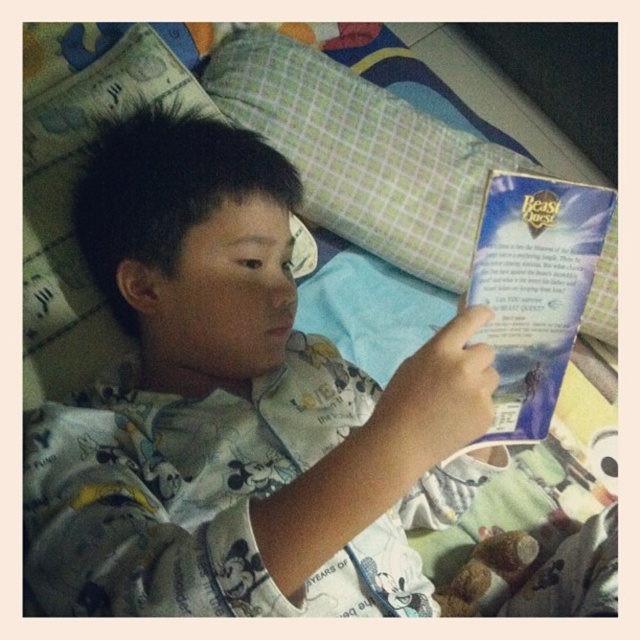
You are standing in the room and want to place a small nightlight on the bed. The nightlight requires 1 meter of space between it and the viewer to function properly. Can you place the nightlight at the point marked as point (x=592, y=292)?

The point (x=592, y=292) is 1.07 meters away from the viewer, which is more than the required 1 meter. Therefore, placing the nightlight there would satisfy the distance requirement.